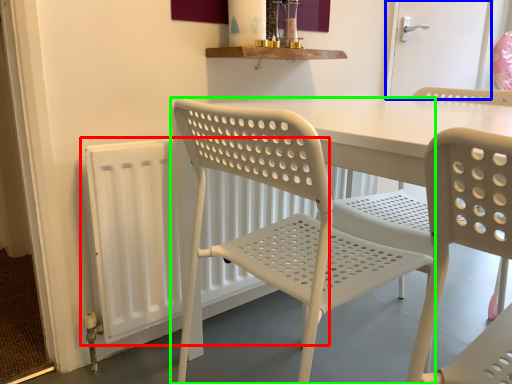
Question: Which object is the farthest from radiator (highlighted by a red box)? Choose among these: screen door (highlighted by a blue box) or chair (highlighted by a green box).

Choices:
 (A) screen door
 (B) chair

Answer: (A)